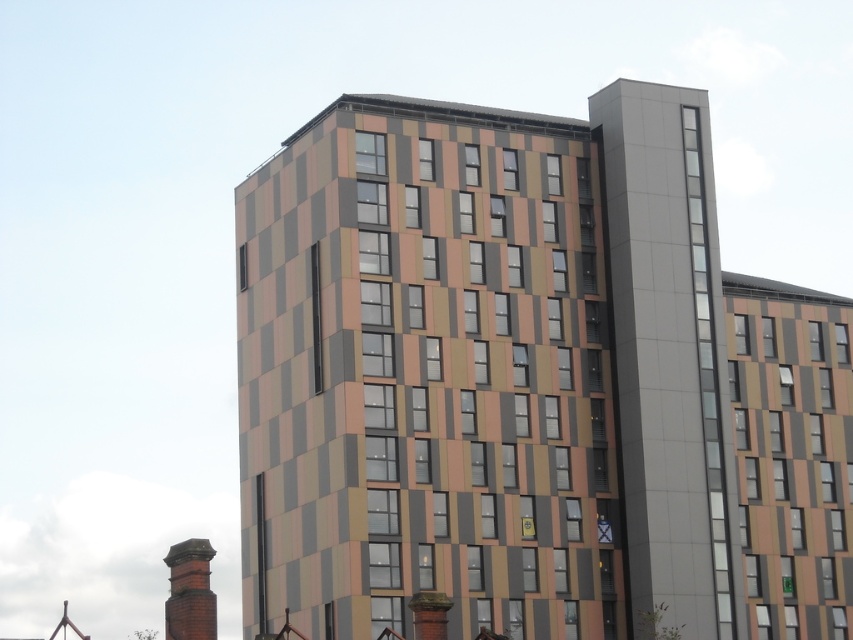
You are an architect reviewing the building design. You need to determine which chimney, the smooth gray chimney at upper right or the red brick chimney at lower left, has a bigger footprint. Based on the provided information, which one is larger?

The smooth gray chimney at upper right has a larger size compared to the red brick chimney at lower left, so the smooth gray chimney at upper right has a bigger footprint.

You are standing in front of the modern multi story building and want to determine the relative positions of two points marked on the building. Based on the image, which point is closer to you, point (651, 467) or point (186, 637)?

Point (651, 467) is further to the viewer than point (186, 637), so point (186, 637) is closer to you.

You are an architect evaluating the building layout. Which object would require more materials to construct between the multicolored textured building at center and the red brick chimney at lower left?

The multicolored textured building at center is bigger than the red brick chimney at lower left, so it would require more materials to construct.